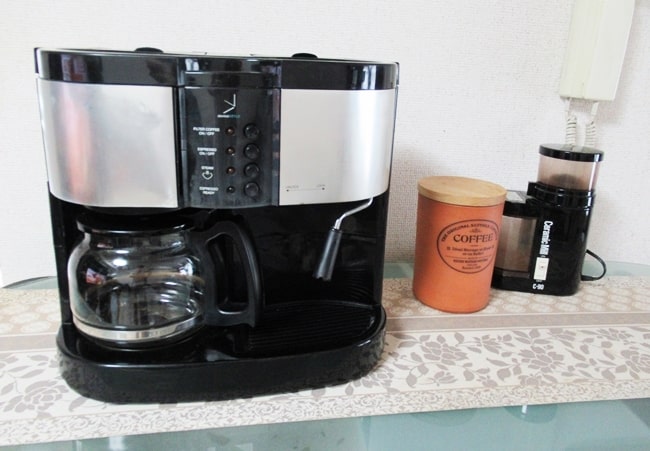
Where is `coffee pot`? coffee pot is located at coordinates (143, 292).